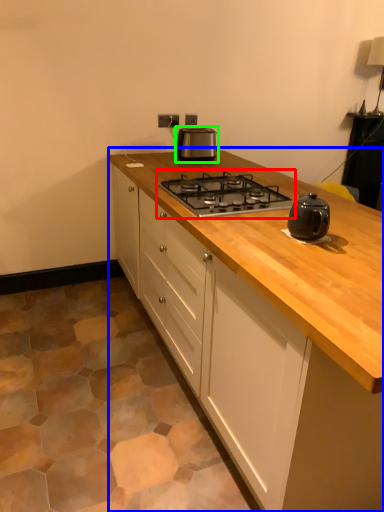
Question: Estimate the real-world distances between objects in this image. Which object is closer to gas stove (highlighted by a red box), cabinetry (highlighted by a blue box) or kitchen appliance (highlighted by a green box)?

Choices:
 (A) cabinetry
 (B) kitchen appliance

Answer: (A)